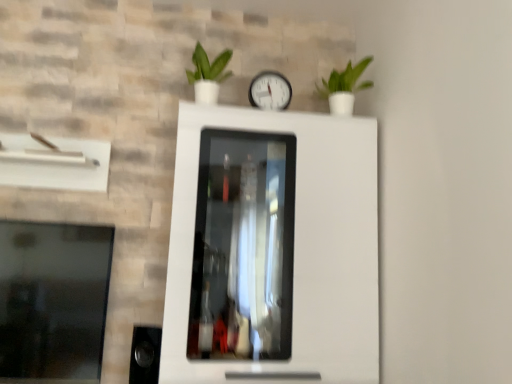
Question: Are green matte plant at upper right, arranged as the first houseplant when viewed from the right, and white plastic clock at center making contact?

Choices:
 (A) yes
 (B) no

Answer: (B)

Question: Is the position of green matte plant at upper right, which appears as the second houseplant when viewed from the left, more distant than that of white plastic clock at center?

Choices:
 (A) yes
 (B) no

Answer: (B)

Question: Is green matte plant at upper right, which appears as the second houseplant when viewed from the left, completely or partially outside of white plastic clock at center?

Choices:
 (A) yes
 (B) no

Answer: (A)

Question: Considering the relative sizes of green matte plant at upper right, arranged as the first houseplant when viewed from the right, and white plastic clock at center in the image provided, is green matte plant at upper right, arranged as the first houseplant when viewed from the right, wider than white plastic clock at center?

Choices:
 (A) yes
 (B) no

Answer: (A)

Question: From a real-world perspective, is green matte plant at upper right, arranged as the first houseplant when viewed from the right, positioned over white plastic clock at center based on gravity?

Choices:
 (A) no
 (B) yes

Answer: (B)

Question: Do you think green matte plant at upper center, the 2th houseplant from the right, is within transparent glass window at left, or outside of it?

Choices:
 (A) inside
 (B) outside

Answer: (B)

Question: Considering the positions of green matte plant at upper center, the 2th houseplant from the right, and transparent glass window at left in the image, is green matte plant at upper center, the 2th houseplant from the right, bigger or smaller than transparent glass window at left?

Choices:
 (A) big
 (B) small

Answer: (B)

Question: Is green matte plant at upper center, which ranks as the 1th houseplant in left-to-right order, taller or shorter than transparent glass window at left?

Choices:
 (A) tall
 (B) short

Answer: (B)

Question: From a real-world perspective, is green matte plant at upper center, the 2th houseplant from the right, above or below transparent glass window at left?

Choices:
 (A) above
 (B) below

Answer: (A)

Question: Is green matte plant at upper center, which ranks as the 1th houseplant in left-to-right order, in front of or behind green matte plant at upper right, which appears as the second houseplant when viewed from the left, in the image?

Choices:
 (A) front
 (B) behind

Answer: (A)

Question: Is green matte plant at upper center, which ranks as the 1th houseplant in left-to-right order, bigger or smaller than green matte plant at upper right, which appears as the second houseplant when viewed from the left?

Choices:
 (A) big
 (B) small

Answer: (B)

Question: From their relative heights in the image, would you say green matte plant at upper center, the 2th houseplant from the right, is taller or shorter than green matte plant at upper right, arranged as the first houseplant when viewed from the right?

Choices:
 (A) tall
 (B) short

Answer: (A)

Question: From the image's perspective, is green matte plant at upper center, which ranks as the 1th houseplant in left-to-right order, positioned above or below green matte plant at upper right, arranged as the first houseplant when viewed from the right?

Choices:
 (A) below
 (B) above

Answer: (B)

Question: Is transparent glass window at left wider or thinner than white plastic clock at center?

Choices:
 (A) wide
 (B) thin

Answer: (B)

Question: Is point (28, 377) closer or farther from the camera than point (252, 96)?

Choices:
 (A) farther
 (B) closer

Answer: (B)